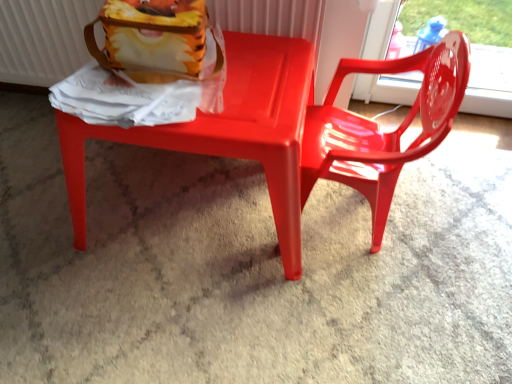
You are a GUI agent. You are given a task and a screenshot of the screen. Output one action in this format:
    pyautogui.click(x=<x>, y=<y>)
    Task: Click on the matte plastic chair at center, which is counted as the 1th chair, starting from the left
    This screenshot has height=384, width=512.
    Given the screenshot: What is the action you would take?
    pyautogui.click(x=227, y=131)

Measure the distance between point (454, 46) and camera.

34.65 inches.

What do you see at coordinates (378, 130) in the screenshot?
I see `glossy plastic chair at center, which is the second chair in left-to-right order` at bounding box center [378, 130].

At what (x,y) coordinates should I click in order to perform the action: click on matte white radiator at upper left. Please return your answer as a coordinate pair (x, y). Looking at the image, I should click on (42, 39).

Find the location of a particular element. The width and height of the screenshot is (512, 384). matte plastic chair at center, which is counted as the 1th chair, starting from the left is located at coordinates (227, 131).

Is matte white radiator at upper left not close to matte plastic chair at center, the 2th chair positioned from the right?

No.

Between matte white radiator at upper left and matte plastic chair at center, which is counted as the 1th chair, starting from the left, which one has smaller size?

With smaller size is matte white radiator at upper left.

Is matte white radiator at upper left oriented towards matte plastic chair at center, which is counted as the 1th chair, starting from the left?

Yes, matte white radiator at upper left is aimed at matte plastic chair at center, which is counted as the 1th chair, starting from the left.

Can matte plastic chair at center, which is counted as the 1th chair, starting from the left, be found inside matte white radiator at upper left?

Definitely not — matte plastic chair at center, which is counted as the 1th chair, starting from the left, is not inside matte white radiator at upper left.

How many degrees apart are the facing directions of matte plastic chair at center, which is counted as the 1th chair, starting from the left, and matte white radiator at upper left?

They differ by 0.223 degrees in their facing directions.

Is matte plastic chair at center, the 2th chair positioned from the right, wider or thinner than matte white radiator at upper left?

Clearly, matte plastic chair at center, the 2th chair positioned from the right, has more width compared to matte white radiator at upper left.

From a real-world perspective, is matte plastic chair at center, which is counted as the 1th chair, starting from the left, positioned over matte white radiator at upper left based on gravity?

No, from a real-world perspective, matte plastic chair at center, which is counted as the 1th chair, starting from the left, is not over matte white radiator at upper left

In the scene shown: Does matte plastic chair at center, which is counted as the 1th chair, starting from the left, turn towards matte white radiator at upper left?

No, matte plastic chair at center, which is counted as the 1th chair, starting from the left, does not turn towards matte white radiator at upper left.

From the image's perspective, which one is positioned lower, glossy plastic chair at center, which is the second chair in left-to-right order, or matte plastic chair at center, the 2th chair positioned from the right?

From the image's view, matte plastic chair at center, the 2th chair positioned from the right, is below.

Is matte plastic chair at center, the 2th chair positioned from the right, inside glossy plastic chair at center, the first chair positioned from the right?

No, matte plastic chair at center, the 2th chair positioned from the right, is not surrounded by glossy plastic chair at center, the first chair positioned from the right.

Is glossy plastic chair at center, which is the second chair in left-to-right order, wider or thinner than matte plastic chair at center, which is counted as the 1th chair, starting from the left?

Clearly, glossy plastic chair at center, which is the second chair in left-to-right order, has less width compared to matte plastic chair at center, which is counted as the 1th chair, starting from the left.

From the image's perspective, which object appears higher, matte plastic chair at center, which is counted as the 1th chair, starting from the left, or glossy plastic chair at center, the first chair positioned from the right?

From the image's view, glossy plastic chair at center, the first chair positioned from the right, is above.

Is matte plastic chair at center, which is counted as the 1th chair, starting from the left, smaller than glossy plastic chair at center, the first chair positioned from the right?

Incorrect, matte plastic chair at center, which is counted as the 1th chair, starting from the left, is not smaller in size than glossy plastic chair at center, the first chair positioned from the right.

Between point (219, 144) and point (421, 154), which one is positioned behind?

The point (219, 144) is farther from the camera.

Which is more to the right, glossy plastic chair at center, which is the second chair in left-to-right order, or matte white radiator at upper left?

From the viewer's perspective, glossy plastic chair at center, which is the second chair in left-to-right order, appears more on the right side.

Considering the positions of objects glossy plastic chair at center, which is the second chair in left-to-right order, and matte white radiator at upper left in the image provided, who is in front, glossy plastic chair at center, which is the second chair in left-to-right order, or matte white radiator at upper left?

glossy plastic chair at center, which is the second chair in left-to-right order, is closer to the camera.

How many degrees apart are the facing directions of glossy plastic chair at center, which is the second chair in left-to-right order, and matte white radiator at upper left?

The angle between the facing direction of glossy plastic chair at center, which is the second chair in left-to-right order, and the facing direction of matte white radiator at upper left is 89.8 degrees.

Can you confirm if glossy plastic chair at center, the first chair positioned from the right, is shorter than matte white radiator at upper left?

No, glossy plastic chair at center, the first chair positioned from the right, is not shorter than matte white radiator at upper left.

Is matte white radiator at upper left wider than glossy plastic chair at center, the first chair positioned from the right?

Incorrect, the width of matte white radiator at upper left does not surpass that of glossy plastic chair at center, the first chair positioned from the right.

Based on the photo, from a real-world perspective, between matte white radiator at upper left and glossy plastic chair at center, the first chair positioned from the right, who is vertically higher?

matte white radiator at upper left is physically above.

This screenshot has height=384, width=512. I want to click on the 2nd chair in front of the matte white radiator at upper left, so click(378, 130).

Is matte white radiator at upper left at the left side of glossy plastic chair at center, the first chair positioned from the right?

Indeed, matte white radiator at upper left is positioned on the left side of glossy plastic chair at center, the first chair positioned from the right.

The image size is (512, 384). What are the coordinates of `radiator behind the matte plastic chair at center, which is counted as the 1th chair, starting from the left` in the screenshot? It's located at [x=42, y=39].

Image resolution: width=512 pixels, height=384 pixels. I want to click on the 2nd chair below the matte white radiator at upper left (from a real-world perspective), so click(x=227, y=131).

Which object lies nearer to the anchor point matte plastic chair at center, the 2th chair positioned from the right, matte white radiator at upper left or glossy plastic chair at center, the first chair positioned from the right?

glossy plastic chair at center, the first chair positioned from the right, is positioned closer to the anchor matte plastic chair at center, the 2th chair positioned from the right.

Looking at the image, which one is located further to glossy plastic chair at center, the first chair positioned from the right, matte plastic chair at center, which is counted as the 1th chair, starting from the left, or matte white radiator at upper left?

matte white radiator at upper left.

Based on their spatial positions, is glossy plastic chair at center, which is the second chair in left-to-right order, or matte white radiator at upper left closer to matte plastic chair at center, the 2th chair positioned from the right?

glossy plastic chair at center, which is the second chair in left-to-right order, is positioned closer to the anchor matte plastic chair at center, the 2th chair positioned from the right.

Considering their positions, is glossy plastic chair at center, the first chair positioned from the right, positioned further to matte white radiator at upper left than matte plastic chair at center, which is counted as the 1th chair, starting from the left?

glossy plastic chair at center, the first chair positioned from the right, is further to matte white radiator at upper left.

Considering their positions, is matte white radiator at upper left positioned closer to glossy plastic chair at center, which is the second chair in left-to-right order, than matte plastic chair at center, which is counted as the 1th chair, starting from the left?

matte plastic chair at center, which is counted as the 1th chair, starting from the left, is positioned closer to the anchor glossy plastic chair at center, which is the second chair in left-to-right order.

Based on their spatial positions, is matte plastic chair at center, which is counted as the 1th chair, starting from the left, or glossy plastic chair at center, which is the second chair in left-to-right order, closer to matte white radiator at upper left?

Among the two, matte plastic chair at center, which is counted as the 1th chair, starting from the left, is located nearer to matte white radiator at upper left.

Where is `chair situated between matte white radiator at upper left and glossy plastic chair at center, the first chair positioned from the right, from left to right`? chair situated between matte white radiator at upper left and glossy plastic chair at center, the first chair positioned from the right, from left to right is located at coordinates (227, 131).